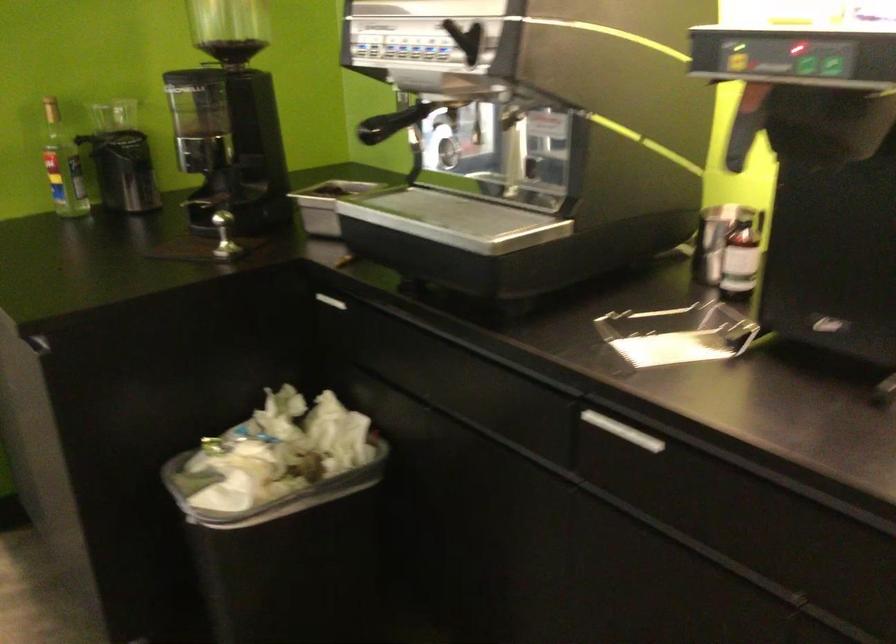
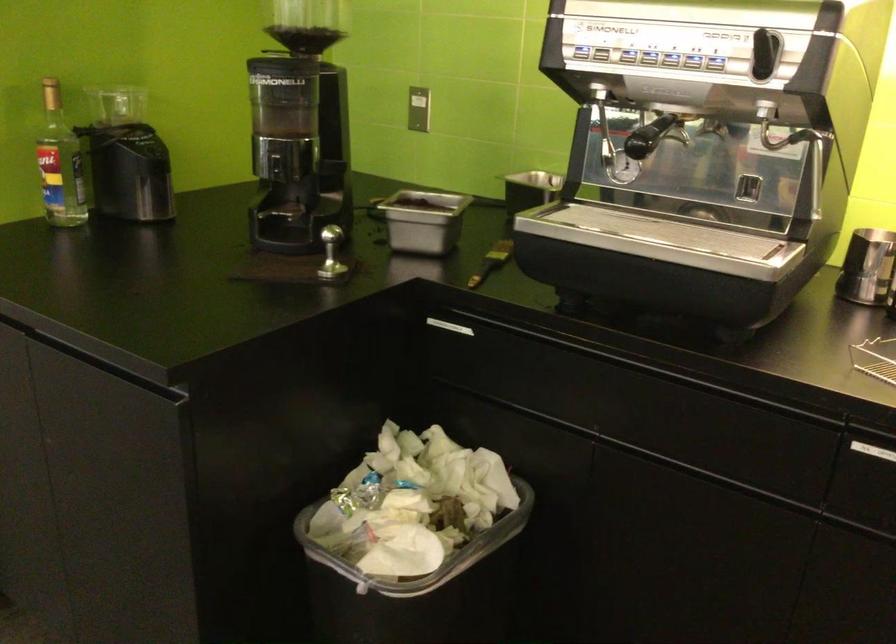
Which direction would the cameraman need to move to produce the second image?

The movement direction of the cameraman is left, forward.